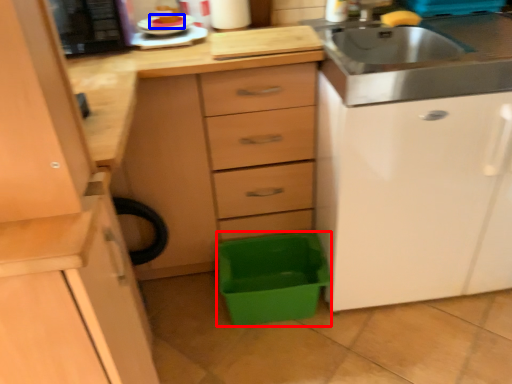
Question: Among these objects, which one is farthest to the camera, storage box (highlighted by a red box) or food (highlighted by a blue box)?

Choices:
 (A) storage box
 (B) food

Answer: (A)